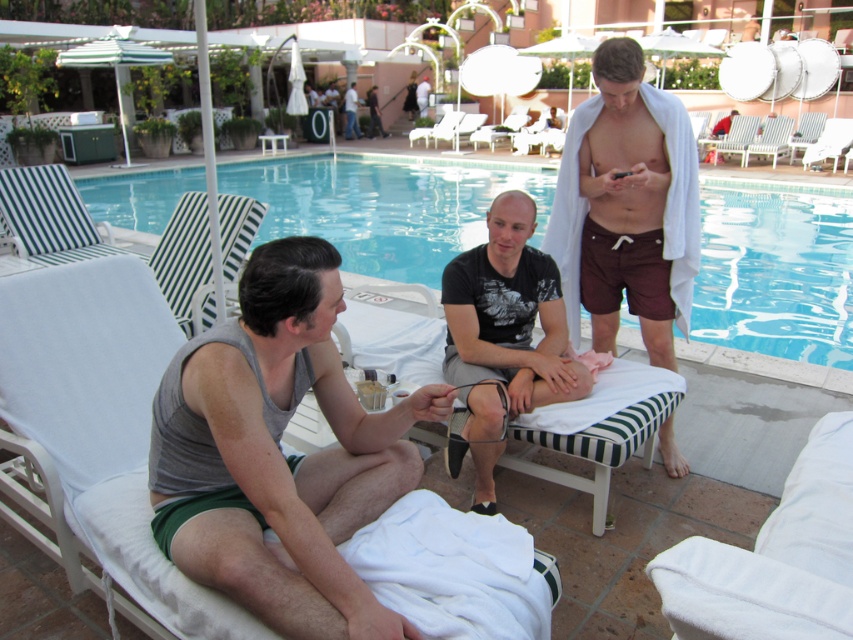
Is transparent glass pool at center to the left of maroon fabric shorts at right from the viewer's perspective?

Yes, transparent glass pool at center is to the left of maroon fabric shorts at right.

This screenshot has height=640, width=853. Find the location of `transparent glass pool at center`. transparent glass pool at center is located at coordinates (775, 273).

Which is above, transparent glass pool at center or black matte t-shirt at center?

Positioned higher is transparent glass pool at center.

Is transparent glass pool at center smaller than black matte t-shirt at center?

No, transparent glass pool at center is not smaller than black matte t-shirt at center.

Is point (706, 220) farther from camera compared to point (456, 289)?

Yes, point (706, 220) is behind point (456, 289).

The height and width of the screenshot is (640, 853). I want to click on transparent glass pool at center, so click(x=775, y=273).

Between gray fabric tank top at center and maroon fabric shorts at right, which one has less height?

Standing shorter between the two is gray fabric tank top at center.

Who is higher up, gray fabric tank top at center or maroon fabric shorts at right?

maroon fabric shorts at right is higher up.

Which is in front, point (370, 509) or point (691, 145)?

Point (370, 509) is in front.

Locate an element on the screen. This screenshot has width=853, height=640. gray fabric tank top at center is located at coordinates (279, 452).